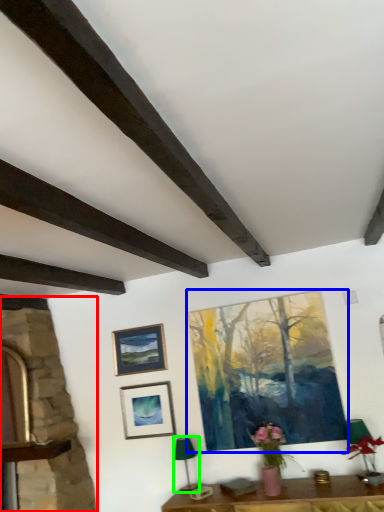
Question: Estimate the real-world distances between objects in this image. Which object is closer to fireplace (highlighted by a red box), picture frame (highlighted by a blue box) or lamp (highlighted by a green box)?

Choices:
 (A) picture frame
 (B) lamp

Answer: (B)